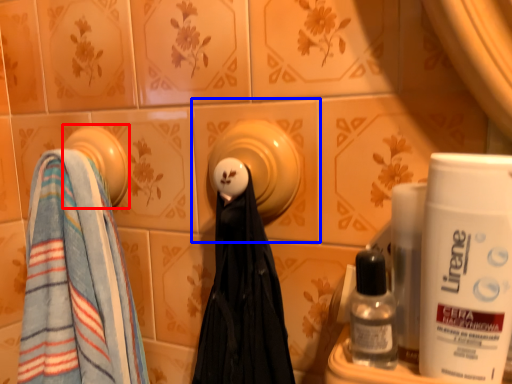
Question: Among these objects, which one is farthest to the camera, towel (highlighted by a red box) or ceramic tile (highlighted by a blue box)?

Choices:
 (A) towel
 (B) ceramic tile

Answer: (A)